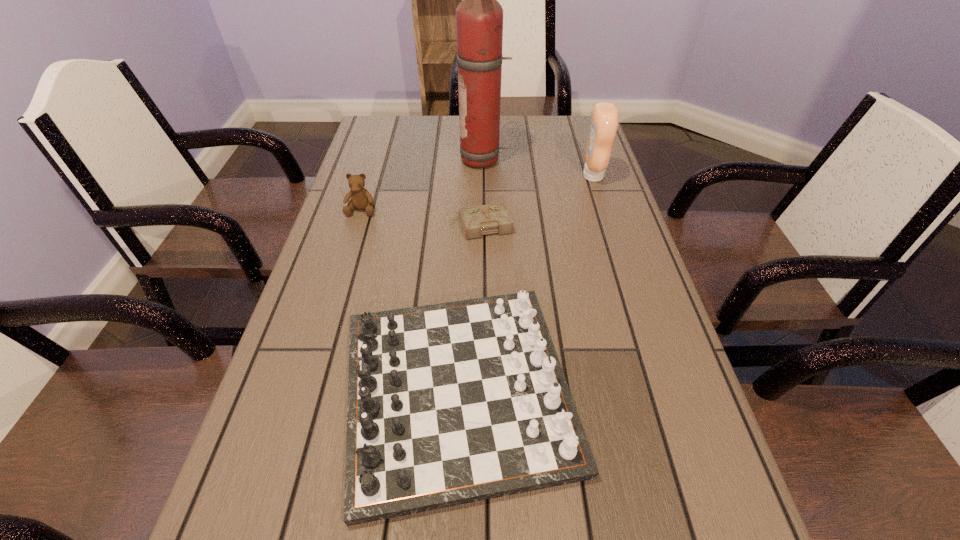
This screenshot has width=960, height=540. Find the location of `vacant area situated on the label of the rightmost object`. vacant area situated on the label of the rightmost object is located at coordinates (446, 176).

Where is `vacant space located on the label of the rightmost object`? This screenshot has width=960, height=540. vacant space located on the label of the rightmost object is located at coordinates (533, 176).

This screenshot has width=960, height=540. Find the location of `free region located on the front-facing side of the teddy bear`. free region located on the front-facing side of the teddy bear is located at coordinates (323, 338).

In order to click on free location located 0.390m on the back of the chessboard in this screenshot , I will do `click(466, 192)`.

The height and width of the screenshot is (540, 960). I want to click on free spot located on the front of the diary, so click(481, 345).

Identify the location of object situated at the far edge. (479, 17).

This screenshot has width=960, height=540. I want to click on teddy bear located in the left edge section of the desktop, so click(x=360, y=198).

You are a GUI agent. You are given a task and a screenshot of the screen. Output one action in this format:
    pyautogui.click(x=<x>, y=<y>)
    Task: Click on the chessboard that is at the left edge
    The image size is (960, 540).
    Given the screenshot: What is the action you would take?
    pyautogui.click(x=452, y=403)

I want to click on object present at the right edge, so click(604, 122).

Locate an element on the screen. The height and width of the screenshot is (540, 960). vacant space at the far edge is located at coordinates (436, 134).